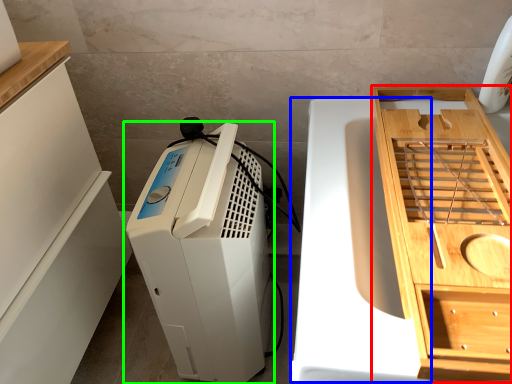
Question: Which object is positioned farthest from cabinetry (highlighted by a red box)? Select from wide (highlighted by a blue box) and home appliance (highlighted by a green box).

Choices:
 (A) wide
 (B) home appliance

Answer: (B)